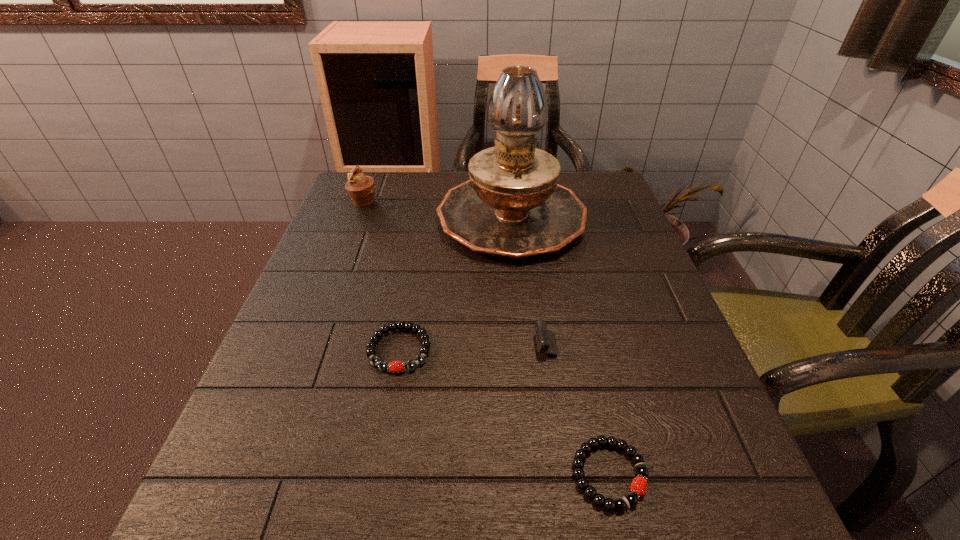
Identify the location of free space between the webcam and the leftmost object. The image size is (960, 540). (475, 273).

At what (x,y) coordinates should I click in order to perform the action: click on unoccupied position between the webcam and the left bracelet. Please return your answer as a coordinate pair (x, y). The width and height of the screenshot is (960, 540). Looking at the image, I should click on (492, 346).

At what (x,y) coordinates should I click in order to perform the action: click on free space between the nearest object and the third tallest object. Please return your answer as a coordinate pair (x, y). This screenshot has height=540, width=960. Looking at the image, I should click on (598, 409).

Find the location of a particular element. empty location between the right bracelet and the left bracelet is located at coordinates (504, 412).

This screenshot has width=960, height=540. In order to click on free space between the farther bracelet and the right bracelet in this screenshot , I will do `click(504, 412)`.

Find the location of a particular element. free spot between the nearer bracelet and the left bracelet is located at coordinates (504, 412).

Image resolution: width=960 pixels, height=540 pixels. I want to click on free space between the oil lamp and the farther bracelet, so click(455, 283).

Locate an element on the screen. The height and width of the screenshot is (540, 960). vacant space that is in between the nearer bracelet and the second tallest object is located at coordinates (487, 339).

Image resolution: width=960 pixels, height=540 pixels. Identify the location of vacant point located between the right bracelet and the webcam. (598, 409).

Locate an element on the screen. The height and width of the screenshot is (540, 960). object that is the third closest to the nearest object is located at coordinates (512, 207).